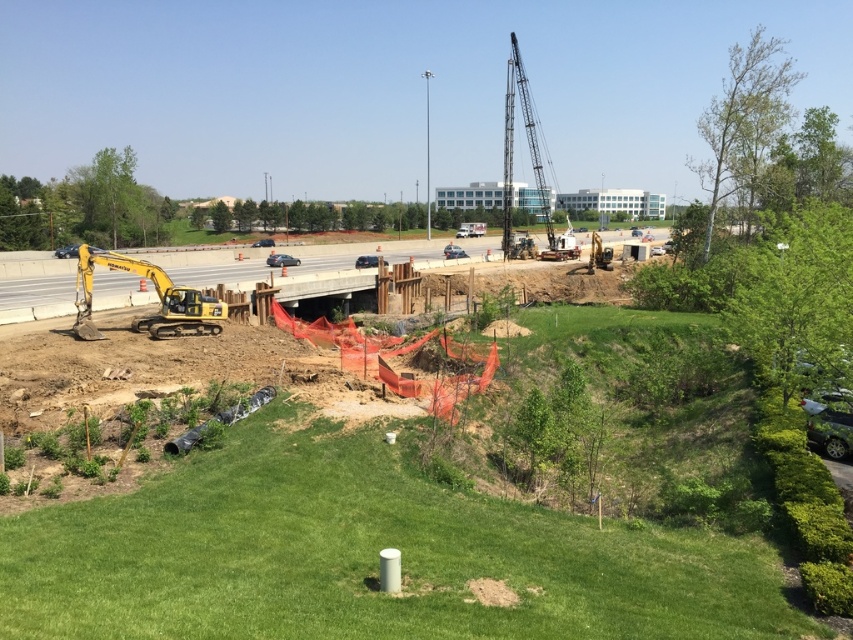
Question: Can you confirm if yellow excavator at lower left is positioned above yellow metallic excavator at lower left?

Choices:
 (A) yes
 (B) no

Answer: (A)

Question: Does yellow excavator at lower left come in front of yellow metallic excavator at lower left?

Choices:
 (A) yes
 (B) no

Answer: (B)

Question: Which of the following is the closest to the observer?

Choices:
 (A) yellow excavator at lower left
 (B) yellow metallic excavator at lower left

Answer: (B)

Question: Which object is farther from the camera taking this photo?

Choices:
 (A) yellow metallic excavator at lower left
 (B) yellow excavator at lower left

Answer: (B)

Question: Is the position of yellow excavator at lower left more distant than that of yellow metallic excavator at lower left?

Choices:
 (A) yes
 (B) no

Answer: (A)

Question: Among these points, which one is nearest to the camera?

Choices:
 (A) (144, 266)
 (B) (115, 307)

Answer: (A)